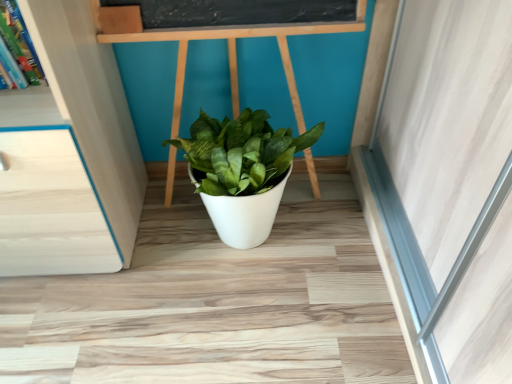
Question: Relative to wooden bookshelf at upper left, is white matte pot at center in front or behind?

Choices:
 (A) front
 (B) behind

Answer: (B)

Question: From a real-world perspective, is white matte pot at center positioned above or below wooden bookshelf at upper left?

Choices:
 (A) below
 (B) above

Answer: (A)

Question: In terms of width, does white matte pot at center look wider or thinner when compared to wooden bookshelf at upper left?

Choices:
 (A) wide
 (B) thin

Answer: (A)

Question: In terms of size, does wooden bookshelf at upper left appear bigger or smaller than white matte pot at center?

Choices:
 (A) big
 (B) small

Answer: (B)

Question: Looking at their shapes, would you say wooden bookshelf at upper left is wider or thinner than white matte pot at center?

Choices:
 (A) thin
 (B) wide

Answer: (A)

Question: Is point (34, 89) closer or farther from the camera than point (223, 228)?

Choices:
 (A) closer
 (B) farther

Answer: (A)

Question: Is wooden bookshelf at upper left taller or shorter than white matte pot at center?

Choices:
 (A) tall
 (B) short

Answer: (B)